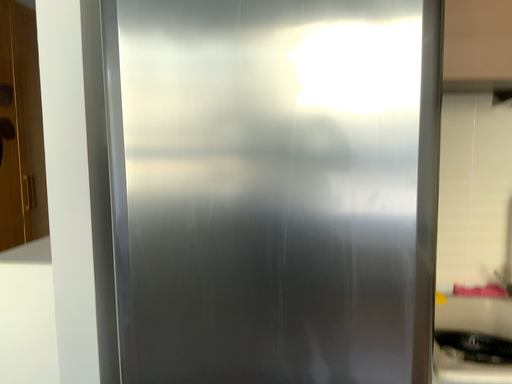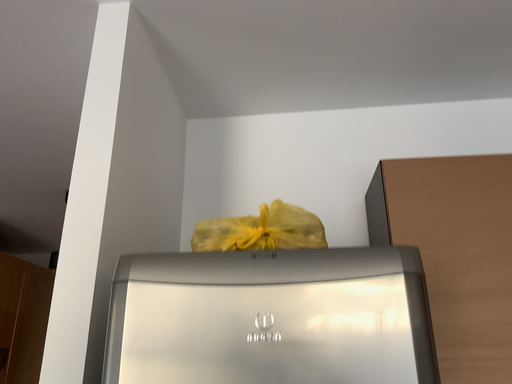
Question: Which way did the camera rotate in the video?

Choices:
 (A) rotated upward
 (B) rotated downward

Answer: (A)